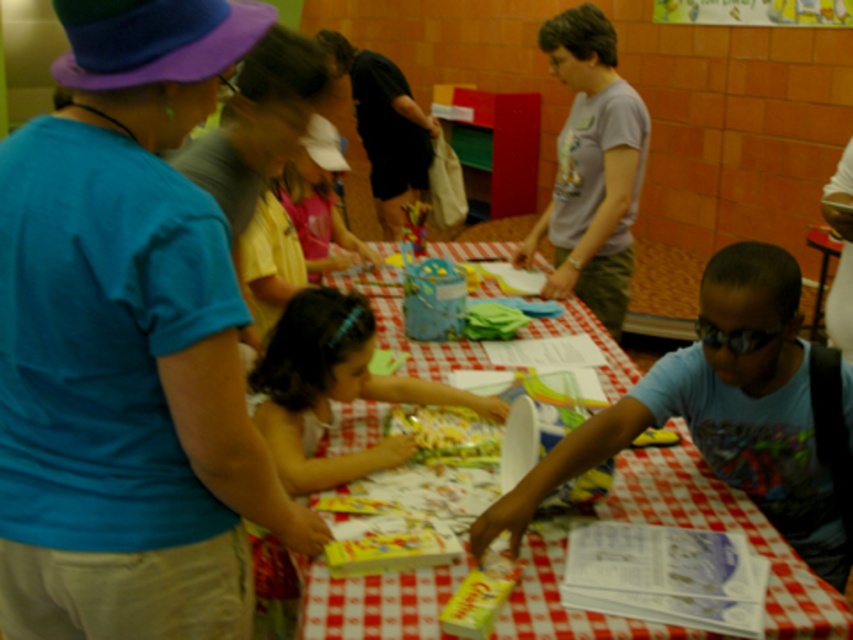
Question: Does blue cotton shirt at left lie behind gray cotton shirt at center?

Choices:
 (A) no
 (B) yes

Answer: (A)

Question: Does blue cotton shirt at left appear under yellow fabric at center?

Choices:
 (A) no
 (B) yes

Answer: (B)

Question: Does gray cotton shirt at center have a lesser width compared to light brown hair at center?

Choices:
 (A) no
 (B) yes

Answer: (B)

Question: Which of the following is the closest to the observer?

Choices:
 (A) light brown hair at center
 (B) gray cotton shirt at center
 (C) yellow fabric at center

Answer: (A)

Question: Which point is farther from the camera taking this photo?

Choices:
 (A) 314,442
 (B) 581,184
 (C) 316,128
 (D) 376,404

Answer: (C)

Question: Which object is positioned farthest from the light brown hair at center?

Choices:
 (A) gray cotton shirt at center
 (B) blue cotton shirt at left
 (C) checkered fabric table at center
 (D) yellow fabric at center

Answer: (A)